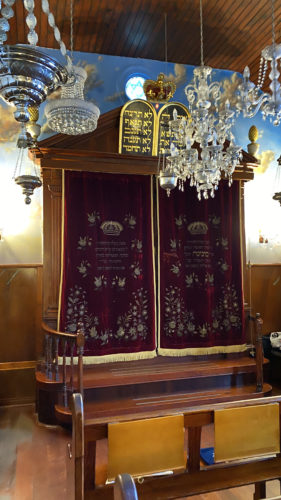
This screenshot has width=281, height=500. I want to click on bench, so pyautogui.click(x=196, y=478).